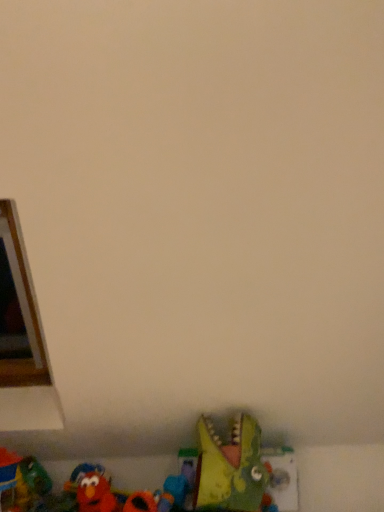
Question: Can you confirm if rubber duck at lower center, which is the fourth toy in left-to-right order, is taller than rubberized red toy at lower left, arranged as the fourth toy when viewed from the right?

Choices:
 (A) yes
 (B) no

Answer: (B)

Question: Is rubber duck at lower center, which is the fourth toy in left-to-right order, wider than rubberized red toy at lower left, which is the 2th toy from left to right?

Choices:
 (A) yes
 (B) no

Answer: (B)

Question: Is rubber duck at lower center, which is the 2th toy in right-to-left order, thinner than rubberized red toy at lower left, arranged as the fourth toy when viewed from the right?

Choices:
 (A) yes
 (B) no

Answer: (A)

Question: From the image's perspective, does rubber duck at lower center, which is the fourth toy in left-to-right order, appear higher than rubberized red toy at lower left, which is the 2th toy from left to right?

Choices:
 (A) no
 (B) yes

Answer: (B)

Question: Is rubberized red toy at lower left, which is the 2th toy from left to right, located within rubber duck at lower center, which is the 2th toy in right-to-left order?

Choices:
 (A) no
 (B) yes

Answer: (A)

Question: Is rubber duck at lower center, which is the fourth toy in left-to-right order, further to the viewer compared to rubberized red toy at lower left, arranged as the fourth toy when viewed from the right?

Choices:
 (A) no
 (B) yes

Answer: (B)

Question: Is velvety red elmo at lower left, acting as the third toy starting from the left, oriented towards rubber duck at lower left, which ranks as the 5th toy in right-to-left order?

Choices:
 (A) no
 (B) yes

Answer: (A)

Question: Considering the relative positions of velvety red elmo at lower left, acting as the third toy starting from the left, and rubber duck at lower left, which ranks as the 5th toy in right-to-left order, in the image provided, is velvety red elmo at lower left, acting as the third toy starting from the left, to the left of rubber duck at lower left, which ranks as the 5th toy in right-to-left order, from the viewer's perspective?

Choices:
 (A) yes
 (B) no

Answer: (B)

Question: Is the position of velvety red elmo at lower left, positioned as the 3th toy in right-to-left order, more distant than that of rubber duck at lower left, which appears as the 1th toy when viewed from the left?

Choices:
 (A) yes
 (B) no

Answer: (A)

Question: Does velvety red elmo at lower left, positioned as the 3th toy in right-to-left order, appear on the right side of rubber duck at lower left, which ranks as the 5th toy in right-to-left order?

Choices:
 (A) no
 (B) yes

Answer: (B)

Question: Is rubber duck at lower left, which appears as the 1th toy when viewed from the left, completely or partially inside velvety red elmo at lower left, acting as the third toy starting from the left?

Choices:
 (A) yes
 (B) no

Answer: (B)

Question: Would you consider rubber duck at lower center, which is the fourth toy in left-to-right order, to be distant from velvety red elmo at lower left, positioned as the 3th toy in right-to-left order?

Choices:
 (A) no
 (B) yes

Answer: (A)